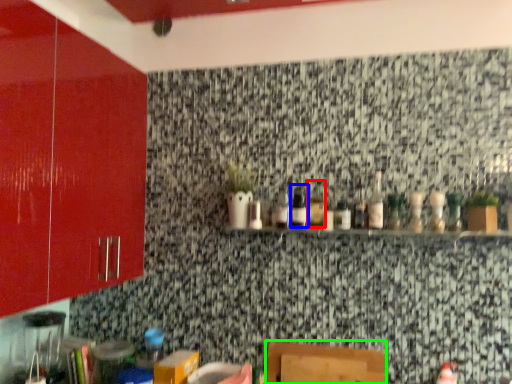
Question: Estimate the real-world distances between objects in this image. Which object is farther from bottle (highlighted by a red box), bottle (highlighted by a blue box) or furniture (highlighted by a green box)?

Choices:
 (A) bottle
 (B) furniture

Answer: (B)